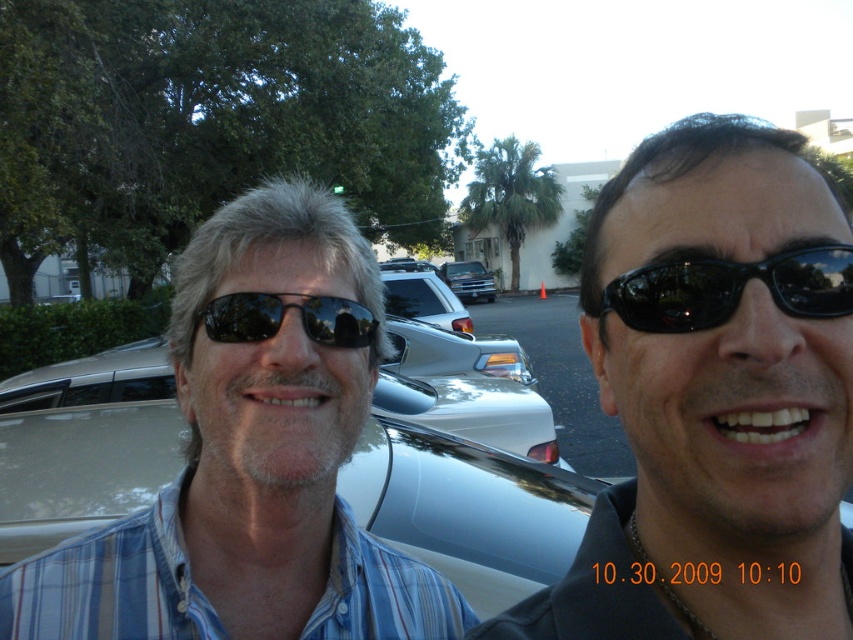
Question: Estimate the real-world distances between objects in this image. Which object is closer to the blue plaid shirt at left?

Choices:
 (A) black glossy sunglasses at center
 (B) black reflective sunglasses at right
 (C) black reflective sunglasses at center

Answer: (C)

Question: Estimate the real-world distances between objects in this image. Which object is closer to the black reflective sunglasses at right?

Choices:
 (A) blue plaid shirt at left
 (B) black glossy sunglasses at center

Answer: (B)

Question: Which of these objects is positioned farthest from the blue plaid shirt at left?

Choices:
 (A) black reflective sunglasses at right
 (B) metallic silver truck at center
 (C) black glossy sunglasses at center
 (D) black reflective sunglasses at center

Answer: (B)

Question: Is black glossy sunglasses at center to the right of metallic silver truck at center from the viewer's perspective?

Choices:
 (A) yes
 (B) no

Answer: (B)

Question: From the image, what is the correct spatial relationship of blue plaid shirt at left in relation to black reflective sunglasses at center?

Choices:
 (A) right
 (B) left

Answer: (B)

Question: Does black reflective sunglasses at center appear on the left side of metallic silver truck at center?

Choices:
 (A) yes
 (B) no

Answer: (A)